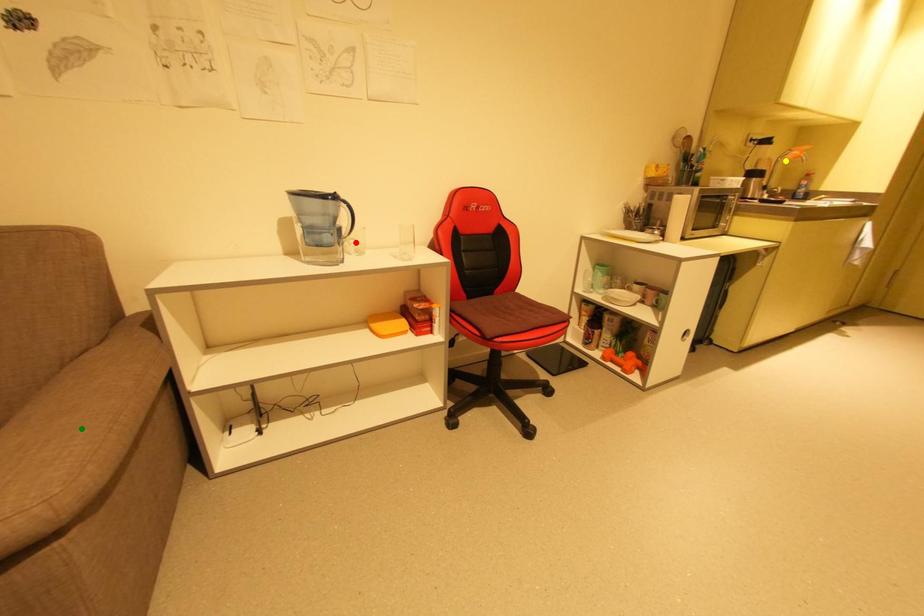
Order these from nearest to farthest:
A) yellow point
B) green point
C) red point

1. yellow point
2. red point
3. green point